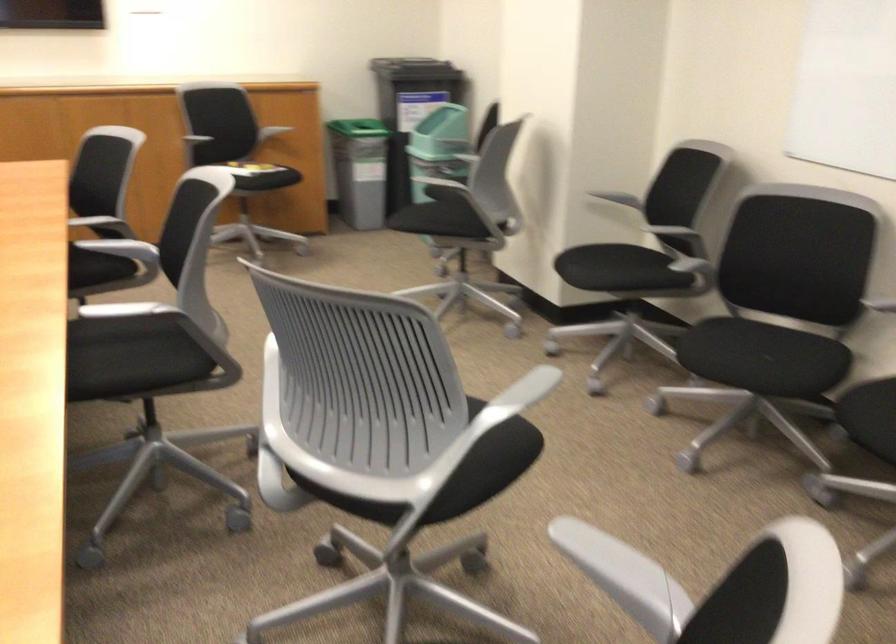
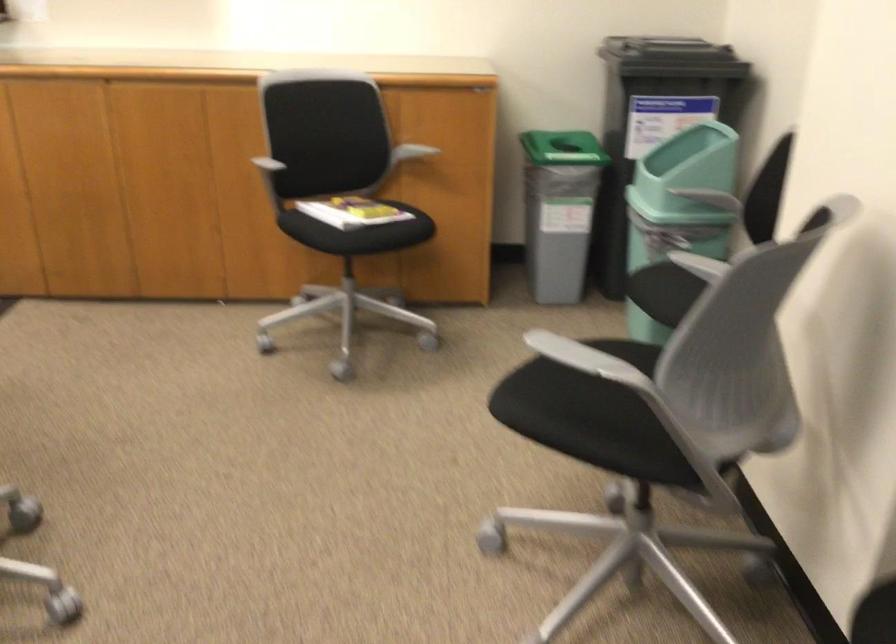
The point at (x=156, y=120) is marked in the first image. Where is the corresponding point in the second image?

(236, 149)